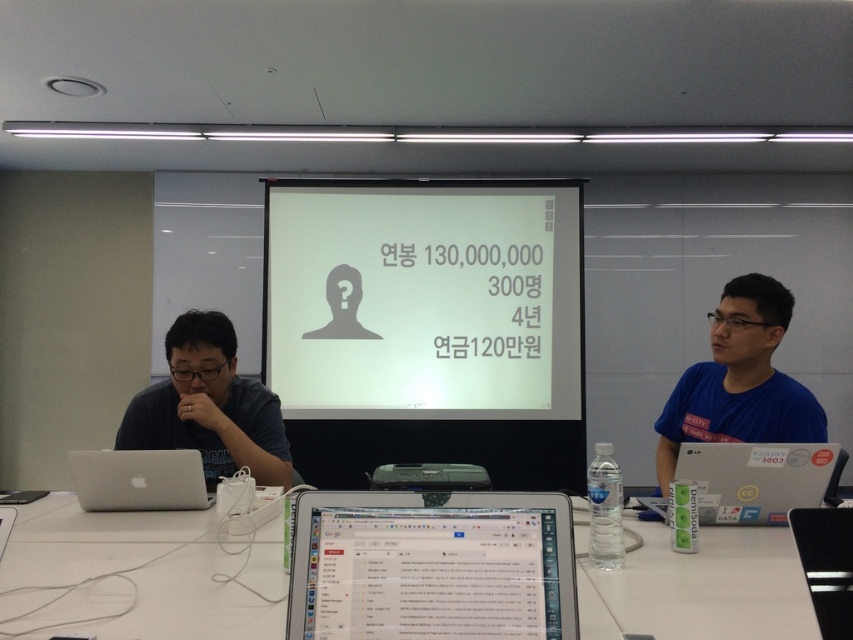
From the picture: How far apart are blue t-shirt at right and matte black projector at center?

They are 29.93 inches apart.

Looking at this image, does blue t-shirt at right lie in front of matte black projector at center?

Yes, blue t-shirt at right is in front of matte black projector at center.

Is point (769, 330) positioned before point (459, 467)?

Yes.

This screenshot has width=853, height=640. I want to click on blue t-shirt at right, so click(740, 380).

Which is in front, point (396, 308) or point (544, 552)?

Point (544, 552) is more forward.

Which of these two, white matte projection screen at center or silver metallic laptop at center, stands taller?

white matte projection screen at center is taller.

In order to click on white matte projection screen at center in this screenshot , I will do `click(422, 300)`.

Is white matte projection screen at center thinner than matte black projector at center?

In fact, white matte projection screen at center might be wider than matte black projector at center.

Does white matte projection screen at center appear on the left side of matte black projector at center?

Correct, you'll find white matte projection screen at center to the left of matte black projector at center.

At what (x,y) coordinates should I click in order to perform the action: click on white matte projection screen at center. Please return your answer as a coordinate pair (x, y). The width and height of the screenshot is (853, 640). Looking at the image, I should click on (422, 300).